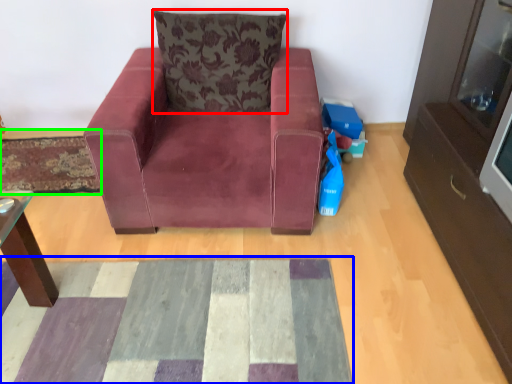
Question: Which object is the closest to the pillow (highlighted by a red box)? Choose among these: mat (highlighted by a blue box) or mat (highlighted by a green box).

Choices:
 (A) mat
 (B) mat

Answer: (B)